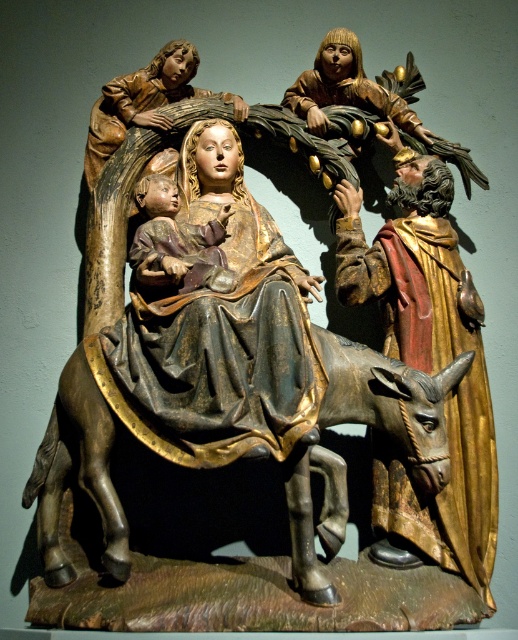
Question: Which object is the farthest from the wooden beard at center?

Choices:
 (A) gold leaf robe at center
 (B) wooden figure at upper center

Answer: (B)

Question: Considering the real-world distances, which object is closest to the bronze/golden donkey at center?

Choices:
 (A) matte gold baby at center
 (B) wooden figure at upper center
 (C) wooden beard at center
 (D) gold leaf robe at center

Answer: (D)

Question: Is gold leaf robe at center above wooden figure at upper center?

Choices:
 (A) yes
 (B) no

Answer: (B)

Question: Is gold leaf robe at center bigger than bronze/golden donkey at center?

Choices:
 (A) no
 (B) yes

Answer: (A)

Question: Does wooden child at upper center have a smaller size compared to matte gold baby at center?

Choices:
 (A) yes
 (B) no

Answer: (B)

Question: Which object is the closest to the bronze/golden donkey at center?

Choices:
 (A) wooden beard at center
 (B) gold leaf robe at center
 (C) wooden figure at upper center

Answer: (B)